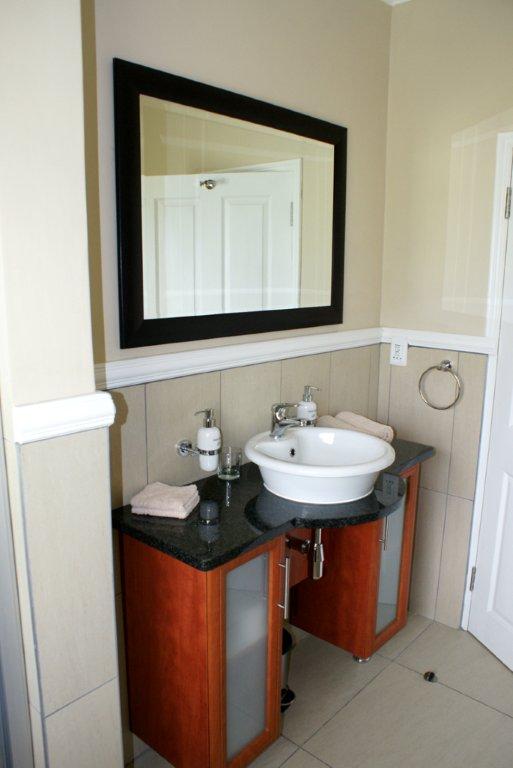
Locate an element on the screen. This screenshot has height=768, width=513. towel holder is located at coordinates (448, 362).